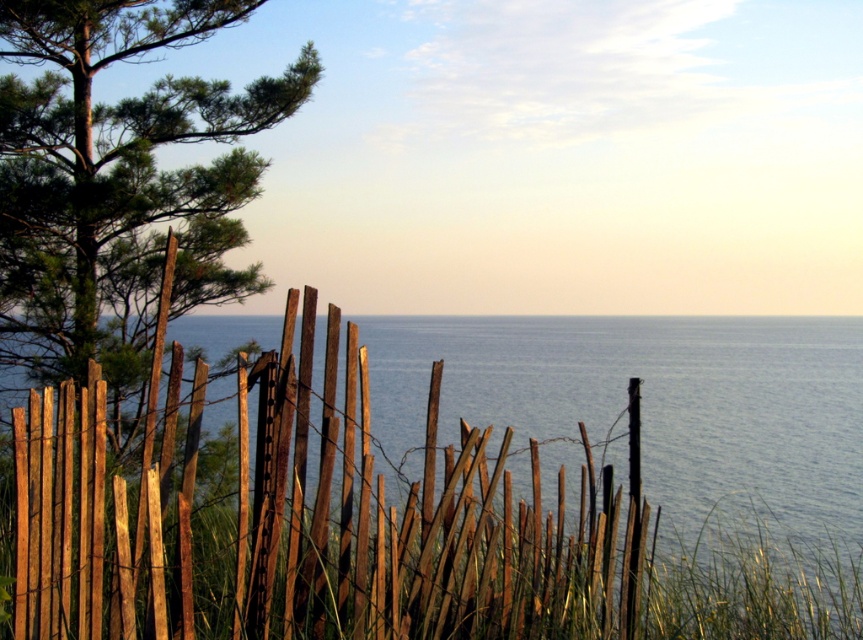
Is weathered wood fence at center thinner than green matte tree at upper left?

No.

Is point (61, 577) closer to viewer compared to point (74, 253)?

Yes, point (61, 577) is closer to viewer.

Between point (142, 634) and point (49, 257), which one is positioned behind?

The point (49, 257) is behind.

Identify the location of weathered wood fence at center. (313, 528).